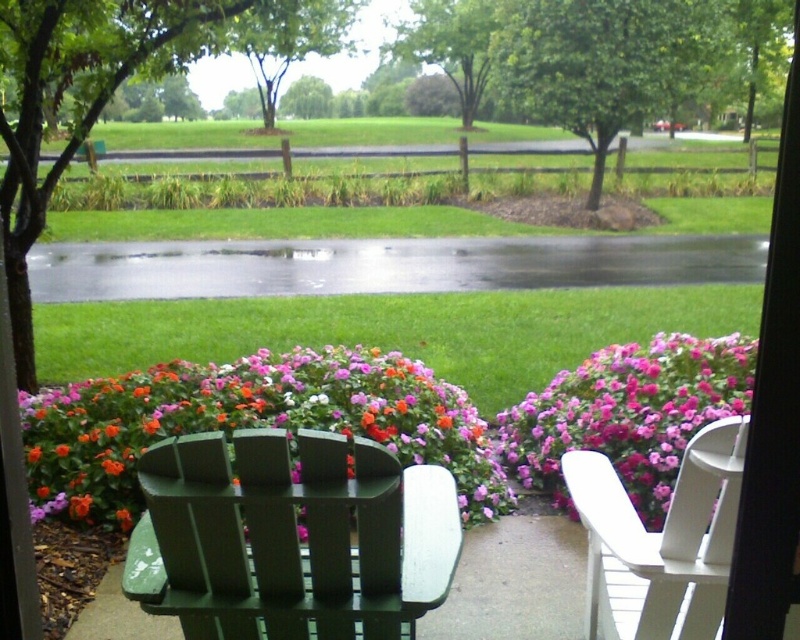
Which is in front, point (360, 444) or point (258, 387)?

Point (360, 444) is more forward.

Is point (144, 605) more distant than point (320, 417)?

No.

Locate an element on the screen. green painted wood chair at lower center is located at coordinates (289, 538).

Is green painted wood chair at lower center bigger than pink matte flowers at right?

Actually, green painted wood chair at lower center might be smaller than pink matte flowers at right.

Is green painted wood chair at lower center to the right of pink matte flowers at right from the viewer's perspective?

In fact, green painted wood chair at lower center is to the left of pink matte flowers at right.

What are the coordinates of `green painted wood chair at lower center` in the screenshot? It's located at (289, 538).

The height and width of the screenshot is (640, 800). What are the coordinates of `green painted wood chair at lower center` in the screenshot? It's located at (289, 538).

Is pink matte flowers at right below white wood chair at right?

Actually, pink matte flowers at right is above white wood chair at right.

How much distance is there between pink matte flowers at right and white wood chair at right?

pink matte flowers at right is 5.15 feet away from white wood chair at right.

Where is `pink matte flowers at right`? The height and width of the screenshot is (640, 800). pink matte flowers at right is located at coordinates (628, 413).